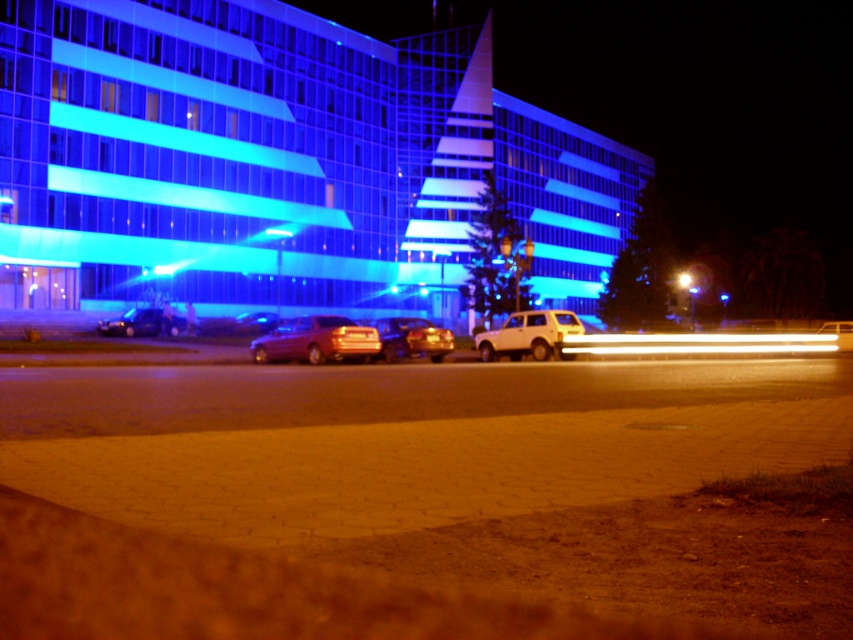
Can you confirm if shiny metallic car at center is positioned to the left of metallic silver car at center?

Indeed, shiny metallic car at center is positioned on the left side of metallic silver car at center.

Is the position of shiny metallic car at center less distant than that of metallic silver car at center?

Yes, shiny metallic car at center is in front of metallic silver car at center.

Does point (398, 323) come farther from viewer compared to point (825, 328)?

No, it is in front of (825, 328).

The height and width of the screenshot is (640, 853). In order to click on shiny metallic car at center in this screenshot , I will do `click(412, 339)`.

Between point (277, 340) and point (439, 353), which one is positioned behind?

Positioned behind is point (439, 353).

Between metallic red sedan at center and shiny metallic car at center, which one has less height?

metallic red sedan at center is shorter.

This screenshot has height=640, width=853. What do you see at coordinates (316, 340) in the screenshot?
I see `metallic red sedan at center` at bounding box center [316, 340].

Where is `metallic red sedan at center`? metallic red sedan at center is located at coordinates (316, 340).

Who is positioned more to the left, white matte suv at center or shiny black sedan at center?

shiny black sedan at center is more to the left.

Is point (492, 349) in front of point (131, 316)?

That is True.

What do you see at coordinates (527, 336) in the screenshot? I see `white matte suv at center` at bounding box center [527, 336].

Identify the location of white matte suv at center. (527, 336).